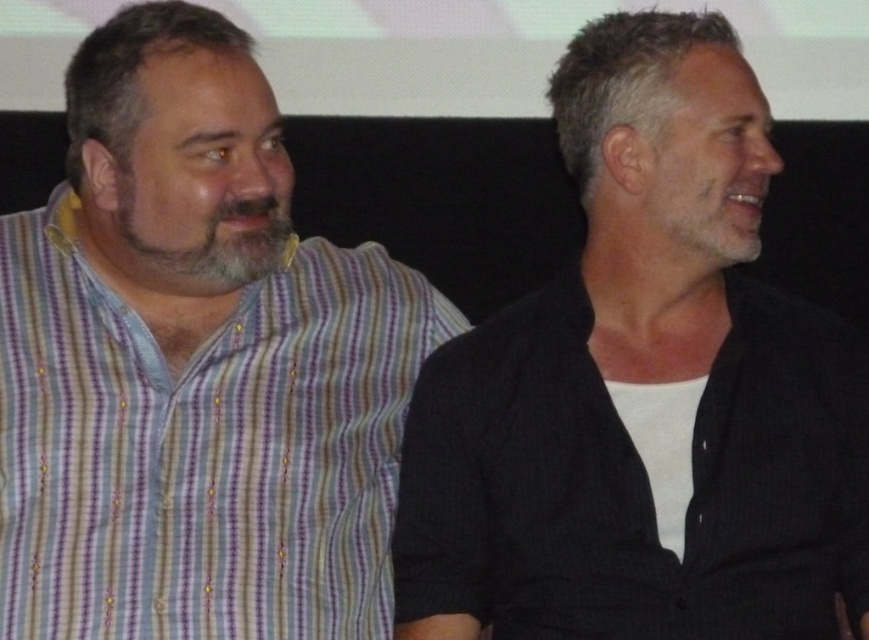
Question: Among these points, which one is nearest to the camera?

Choices:
 (A) tap(194, 515)
 (B) tap(222, 204)

Answer: (B)

Question: Which of the following is the closest to the observer?

Choices:
 (A) graywoollybeard at left
 (B) striped cotton shirt at left
 (C) dark gray textured shirt at center

Answer: (C)

Question: Is dark gray textured shirt at center closer to camera compared to graywoollybeard at left?

Choices:
 (A) yes
 (B) no

Answer: (A)

Question: Can you confirm if striped cotton shirt at left is thinner than graywoollybeard at left?

Choices:
 (A) yes
 (B) no

Answer: (B)

Question: Based on their relative distances, which object is nearer to the dark gray textured shirt at center?

Choices:
 (A) graywoollybeard at left
 (B) striped cotton shirt at left

Answer: (B)

Question: Is the position of dark gray textured shirt at center more distant than that of striped cotton shirt at left?

Choices:
 (A) yes
 (B) no

Answer: (B)